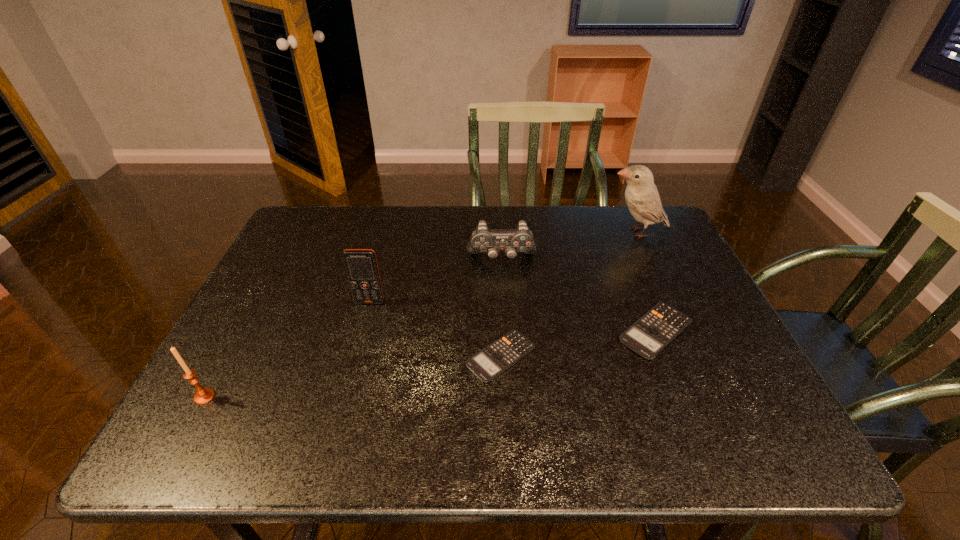
Where is `free area in between the fifth object from right to left and the nearest object`? This screenshot has width=960, height=540. free area in between the fifth object from right to left and the nearest object is located at coordinates (287, 349).

You are a GUI agent. You are given a task and a screenshot of the screen. Output one action in this format:
    pyautogui.click(x=<x>, y=<y>)
    Task: Click on the vacant area between the left calculator and the cellular telephone
    
    Given the screenshot: What is the action you would take?
    pyautogui.click(x=436, y=329)

Locate which object is the closest to the second shortest object. Please provide its 2D coordinates. Your answer should be formatted as a tuple, i.e. [(x, y)], where the tuple contains the x and y coordinates of a point satisfying the conditions above.

[(494, 359)]

Locate which object is the fifth closest to the candle_holder. Please provide its 2D coordinates. Your answer should be formatted as a tuple, i.e. [(x, y)], where the tuple contains the x and y coordinates of a point satisfying the conditions above.

[(641, 195)]

At what (x,y) coordinates should I click in order to perform the action: click on vacant space that satisfies the following two spatial constraints: 1. on the surface of the fifth nearest object with buttons; 2. on the right side of the taller calculator. Please return your answer as a coordinate pair (x, y). This screenshot has height=540, width=960. Looking at the image, I should click on (506, 330).

This screenshot has height=540, width=960. In order to click on vacant region that satisfies the following two spatial constraints: 1. on the surface of the taller calculator with buttons; 2. on the left side of the second farthest object in this screenshot , I will do `click(506, 330)`.

The height and width of the screenshot is (540, 960). I want to click on free space that satisfies the following two spatial constraints: 1. on the screen of the cellular telephone; 2. on the right side of the second shortest object, so click(x=362, y=330).